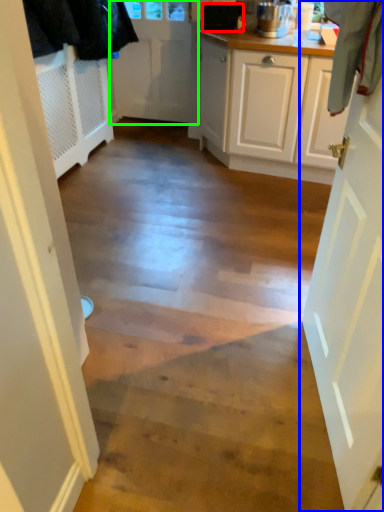
Question: Estimate the real-world distances between objects in this image. Which object is closer to appliance (highlighted by a red box), door (highlighted by a blue box) or door (highlighted by a green box)?

Choices:
 (A) door
 (B) door

Answer: (B)